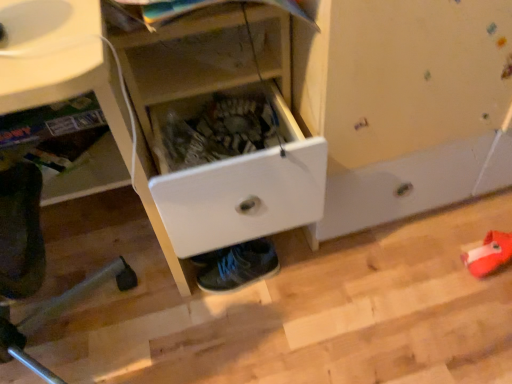
Question: Does white plastic drawer at center have a greater height compared to white plastic drawer at center?

Choices:
 (A) yes
 (B) no

Answer: (A)

Question: Does white plastic drawer at center have a lesser width compared to white plastic drawer at center?

Choices:
 (A) no
 (B) yes

Answer: (A)

Question: From the image's perspective, does white plastic drawer at center appear lower than white plastic drawer at center?

Choices:
 (A) no
 (B) yes

Answer: (B)

Question: Would you say white plastic drawer at center is outside white plastic drawer at center?

Choices:
 (A) no
 (B) yes

Answer: (B)

Question: From a real-world perspective, is white plastic drawer at center physically above white plastic drawer at center?

Choices:
 (A) yes
 (B) no

Answer: (A)

Question: Would you say shiny blue sneakers at lower center is to the left or to the right of white plastic drawer at lower center in the picture?

Choices:
 (A) left
 (B) right

Answer: (B)

Question: From a real-world perspective, is shiny blue sneakers at lower center above or below white plastic drawer at lower center?

Choices:
 (A) above
 (B) below

Answer: (B)

Question: From the image's perspective, relative to white plastic drawer at lower center, is shiny blue sneakers at lower center above or below?

Choices:
 (A) below
 (B) above

Answer: (A)

Question: Considering their positions, is shiny blue sneakers at lower center located in front of or behind white plastic drawer at lower center?

Choices:
 (A) front
 (B) behind

Answer: (B)

Question: Considering the positions of white plastic drawer at center and white plastic drawer at center in the image, is white plastic drawer at center taller or shorter than white plastic drawer at center?

Choices:
 (A) tall
 (B) short

Answer: (B)

Question: Considering their positions, is white plastic drawer at center located in front of or behind white plastic drawer at center?

Choices:
 (A) behind
 (B) front

Answer: (A)

Question: Does point (203, 223) appear closer or farther from the camera than point (138, 69)?

Choices:
 (A) closer
 (B) farther

Answer: (A)

Question: Is white plastic drawer at center bigger or smaller than white plastic drawer at center?

Choices:
 (A) small
 (B) big

Answer: (A)

Question: From their relative heights in the image, would you say white plastic drawer at center is taller or shorter than white plastic drawer at lower center?

Choices:
 (A) tall
 (B) short

Answer: (A)

Question: From a real-world perspective, is white plastic drawer at center physically located above or below white plastic drawer at lower center?

Choices:
 (A) above
 (B) below

Answer: (A)